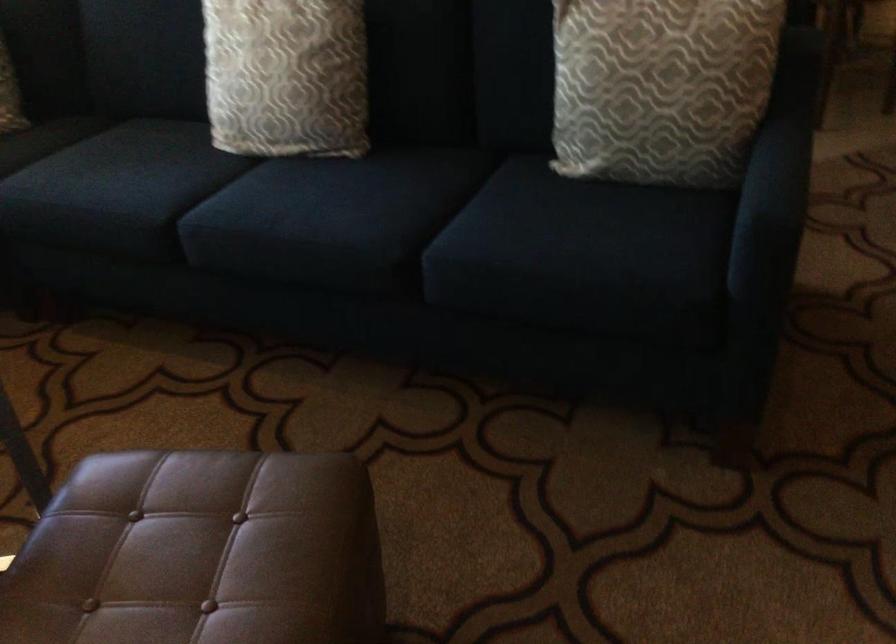
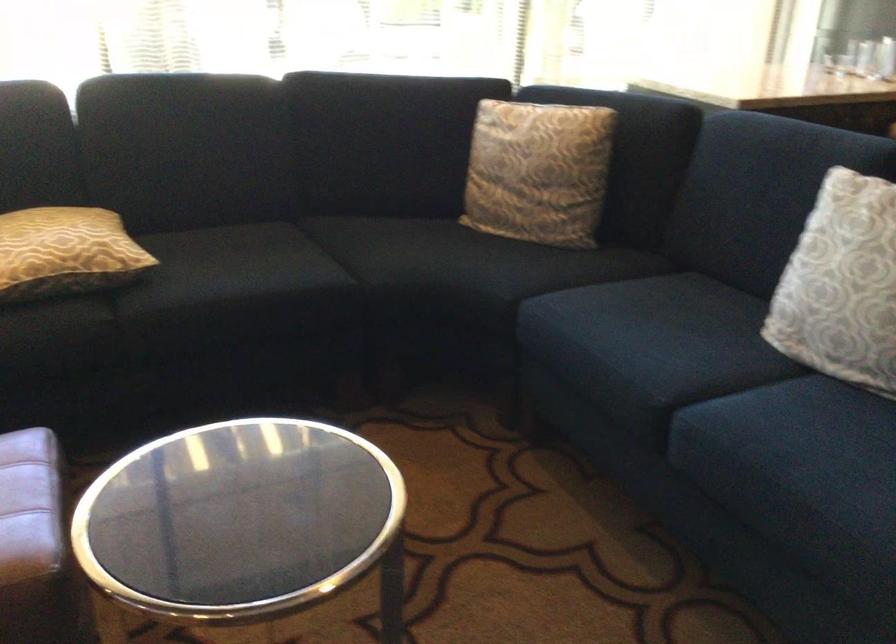
Question: I am providing you with two images of the same scene from different viewpoints. Please identify which objects are invisible in image2.

Choices:
 (A) patterned gold pillow
 (B) sofa sitting surface
 (C) patterned grey pillow
 (D) none of these

Answer: (D)